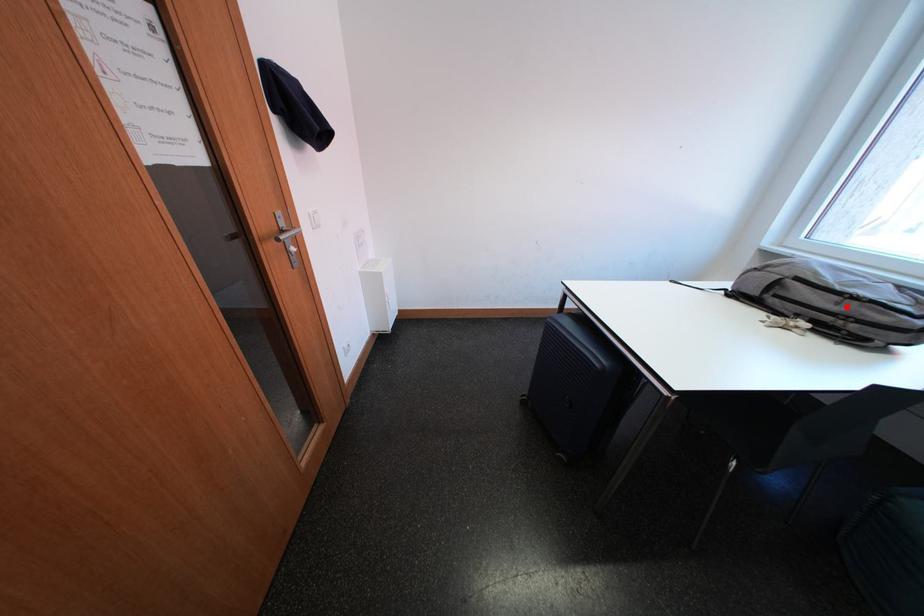
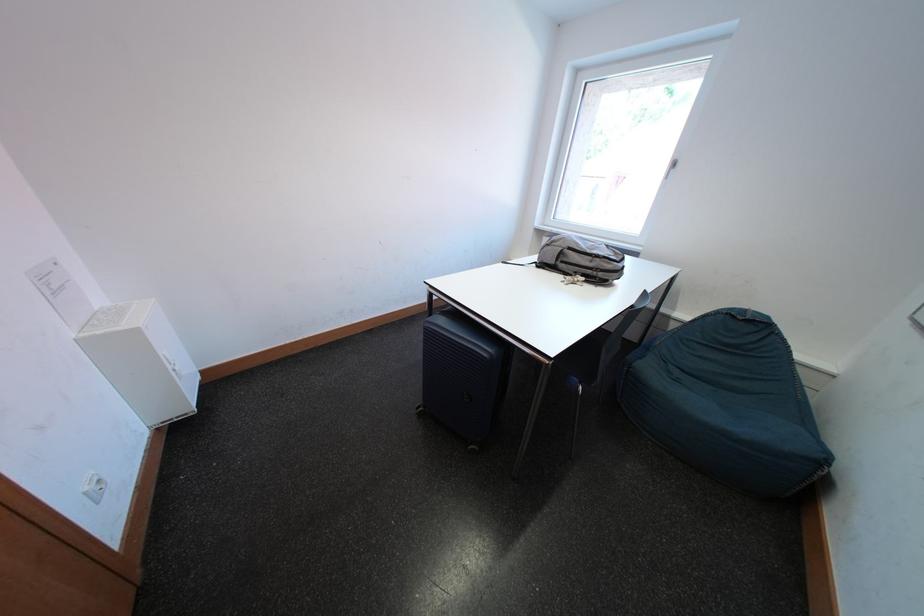
Where in the second image is the point corresponding to the highlighted location from the first image?

(601, 265)